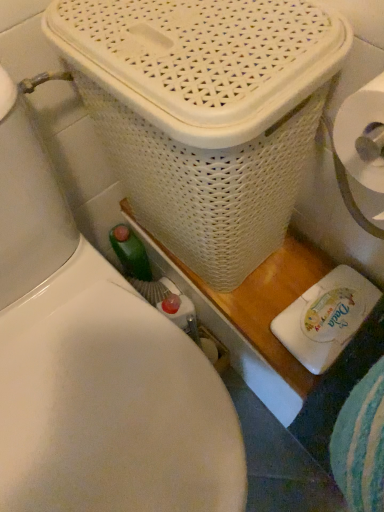
Question: Is white plastic toilet at upper center looking in the opposite direction of white wicker basket at upper center?

Choices:
 (A) no
 (B) yes

Answer: (A)

Question: Is white plastic toilet at upper center not within white wicker basket at upper center?

Choices:
 (A) no
 (B) yes

Answer: (B)

Question: From the image's perspective, is white plastic toilet at upper center below white wicker basket at upper center?

Choices:
 (A) yes
 (B) no

Answer: (A)

Question: Is white plastic toilet at upper center oriented towards white wicker basket at upper center?

Choices:
 (A) no
 (B) yes

Answer: (A)

Question: Could white wicker basket at upper center be considered to be inside white plastic toilet at upper center?

Choices:
 (A) yes
 (B) no

Answer: (B)

Question: Is white plastic toilet at upper center to the right of white wicker basket at upper center from the viewer's perspective?

Choices:
 (A) yes
 (B) no

Answer: (B)

Question: Is white wicker basket at upper center positioned behind white plastic toilet at upper center?

Choices:
 (A) yes
 (B) no

Answer: (A)

Question: Could you tell me if white wicker basket at upper center is facing white plastic toilet at upper center?

Choices:
 (A) no
 (B) yes

Answer: (B)

Question: Is white wicker basket at upper center outside white plastic toilet at upper center?

Choices:
 (A) no
 (B) yes

Answer: (B)

Question: From the image's perspective, is white wicker basket at upper center on white plastic toilet at upper center?

Choices:
 (A) yes
 (B) no

Answer: (A)

Question: Is there a large distance between white wicker basket at upper center and white plastic toilet at upper center?

Choices:
 (A) yes
 (B) no

Answer: (B)

Question: From the image's perspective, is white wicker basket at upper center located beneath white plastic toilet at upper center?

Choices:
 (A) no
 (B) yes

Answer: (A)

Question: From a real-world perspective, is white plastic toilet at upper center above or below white wicker basket at upper center?

Choices:
 (A) below
 (B) above

Answer: (A)